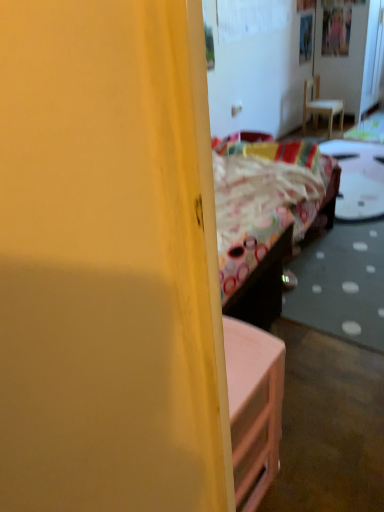
Locate an element on the screen. This screenshot has height=512, width=384. white matte chair at upper right is located at coordinates (320, 105).

What do you see at coordinates (320, 105) in the screenshot? The width and height of the screenshot is (384, 512). I see `white matte chair at upper right` at bounding box center [320, 105].

Find the location of a particular element. white matte chair at upper right is located at coordinates (320, 105).